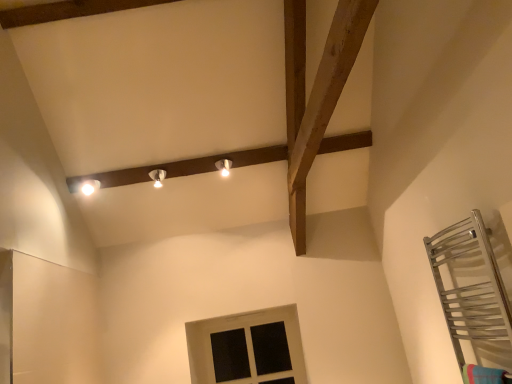
Question: From the image's perspective, is matte white light fixture at upper left, the 1th light fixture from the left, above matte white light fixture at upper center, the third light fixture positioned from the left?

Choices:
 (A) yes
 (B) no

Answer: (B)

Question: Is matte white light fixture at upper left, the 3th light fixture in the right-to-left sequence, at the right side of matte white light fixture at upper center, the third light fixture positioned from the left?

Choices:
 (A) no
 (B) yes

Answer: (A)

Question: Is matte white light fixture at upper left, the 1th light fixture from the left, to the left of matte white light fixture at upper center, the third light fixture positioned from the left, from the viewer's perspective?

Choices:
 (A) no
 (B) yes

Answer: (B)

Question: Is matte white light fixture at upper left, the 1th light fixture from the left, not near matte white light fixture at upper center, the third light fixture positioned from the left?

Choices:
 (A) yes
 (B) no

Answer: (B)

Question: Can you confirm if matte white light fixture at upper left, the 3th light fixture in the right-to-left sequence, is bigger than matte white light fixture at upper center, the third light fixture positioned from the left?

Choices:
 (A) yes
 (B) no

Answer: (A)

Question: Considering the positions of matte white light fixture at upper left, the 3th light fixture in the right-to-left sequence, and white painted wood window at lower center in the image, is matte white light fixture at upper left, the 3th light fixture in the right-to-left sequence, wider or thinner than white painted wood window at lower center?

Choices:
 (A) wide
 (B) thin

Answer: (A)

Question: In the image, is matte white light fixture at upper left, the 1th light fixture from the left, positioned in front of or behind white painted wood window at lower center?

Choices:
 (A) front
 (B) behind

Answer: (A)

Question: Which is correct: matte white light fixture at upper left, the 1th light fixture from the left, is inside white painted wood window at lower center, or outside of it?

Choices:
 (A) inside
 (B) outside

Answer: (B)

Question: From their relative heights in the image, would you say matte white light fixture at upper left, the 1th light fixture from the left, is taller or shorter than white painted wood window at lower center?

Choices:
 (A) tall
 (B) short

Answer: (B)

Question: Considering the positions of matte white light fixture at center, the 2th light fixture from the right, and matte white light fixture at upper center, the third light fixture positioned from the left, in the image, is matte white light fixture at center, the 2th light fixture from the right, taller or shorter than matte white light fixture at upper center, the third light fixture positioned from the left,?

Choices:
 (A) tall
 (B) short

Answer: (A)

Question: Is matte white light fixture at center, the 2th light fixture from the right, wider or thinner than matte white light fixture at upper center, marked as the first light fixture in a right-to-left arrangement?

Choices:
 (A) thin
 (B) wide

Answer: (B)

Question: In the image, is matte white light fixture at center, the 2th light fixture from the right, on the left side or the right side of matte white light fixture at upper center, the third light fixture positioned from the left?

Choices:
 (A) left
 (B) right

Answer: (A)

Question: From the image's perspective, is matte white light fixture at center, which appears as the 2th light fixture when viewed from the left, positioned above or below matte white light fixture at upper center, marked as the first light fixture in a right-to-left arrangement?

Choices:
 (A) above
 (B) below

Answer: (B)

Question: Would you say white painted wood window at lower center is to the left or to the right of matte white light fixture at upper left, the 3th light fixture in the right-to-left sequence, in the picture?

Choices:
 (A) right
 (B) left

Answer: (A)

Question: In terms of width, does white painted wood window at lower center look wider or thinner when compared to matte white light fixture at upper left, the 1th light fixture from the left?

Choices:
 (A) wide
 (B) thin

Answer: (B)